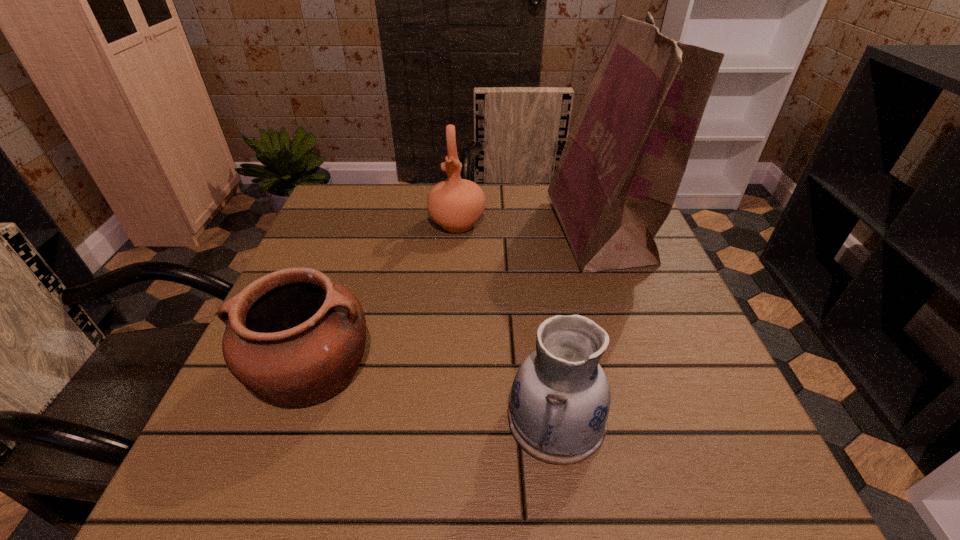
The height and width of the screenshot is (540, 960). I want to click on free spot between the farthest pottery and the shortest pottery, so click(384, 295).

Find the location of a particular element. blank region between the second shortest pottery and the leftmost pottery is located at coordinates (434, 393).

Where is `unoccupied area between the second pottery from right to left and the third tallest object`? unoccupied area between the second pottery from right to left and the third tallest object is located at coordinates (507, 321).

This screenshot has height=540, width=960. Identify the location of the closest object to the tallest object. (456, 204).

This screenshot has height=540, width=960. What are the coordinates of `the third closest object relative to the third tallest object` in the screenshot? It's located at (456, 204).

Find the location of a particular element. This screenshot has height=540, width=960. pottery that can be found as the closest to the rightmost pottery is located at coordinates (294, 337).

Select which pottery is the closest to the shortest object. Please provide its 2D coordinates. Your answer should be formatted as a tuple, i.e. [(x, y)], where the tuple contains the x and y coordinates of a point satisfying the conditions above.

[(560, 399)]

What are the coordinates of `vacant position in the image that satisfies the following two spatial constraints: 1. on the front-facing side of the tallest object; 2. on the front side of the shortest pottery` in the screenshot? It's located at (647, 367).

This screenshot has width=960, height=540. Identify the location of free space that satisfies the following two spatial constraints: 1. on the front-facing side of the tallest object; 2. on the front side of the leftmost object. (647, 367).

What are the coordinates of `vacant space that satisfies the following two spatial constraints: 1. on the front-facing side of the grocery bag; 2. on the front side of the leftmost pottery` in the screenshot? It's located at (647, 367).